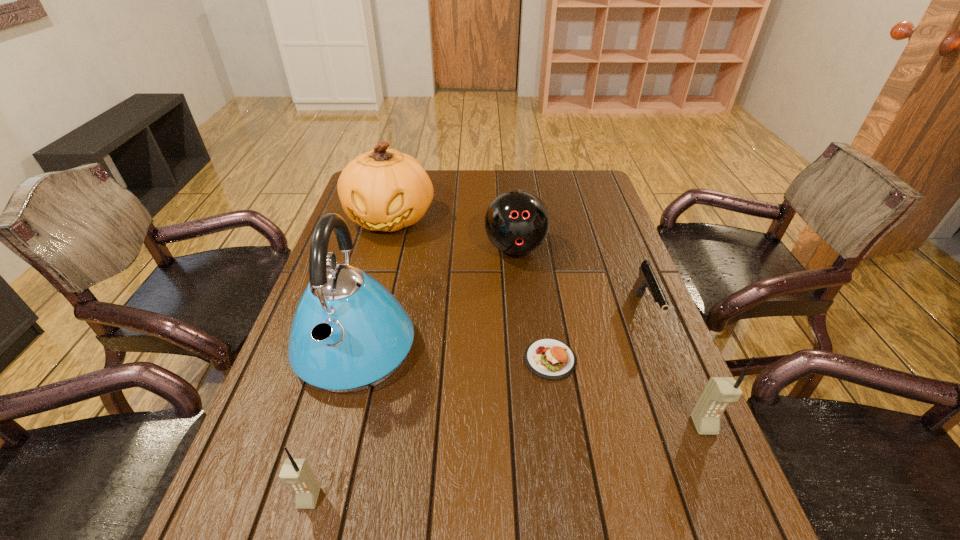
Where is `free space that satisfies the following two spatial constraints: 1. at the spout of the patty (food); 2. on the right side of the kettle`? free space that satisfies the following two spatial constraints: 1. at the spout of the patty (food); 2. on the right side of the kettle is located at coordinates (352, 359).

This screenshot has height=540, width=960. I want to click on vacant region that satisfies the following two spatial constraints: 1. on the front face of the pumpkin; 2. on the right side of the patty (food), so click(x=352, y=359).